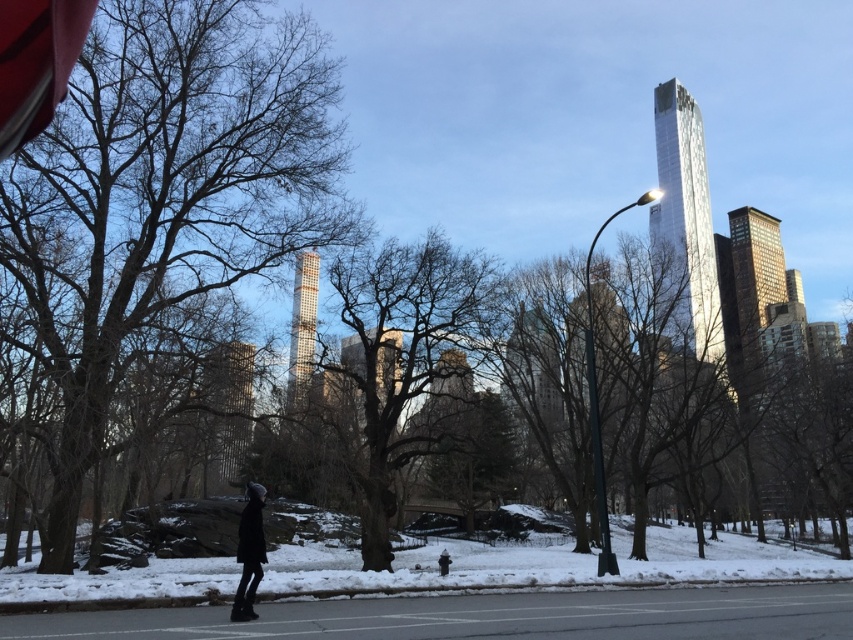
Question: Is smooth brown tree at left smaller than black matte coat at center?

Choices:
 (A) yes
 (B) no

Answer: (B)

Question: Estimate the real-world distances between objects in this image. Which object is closer to the smooth brown tree at left?

Choices:
 (A) black wool coat at lower left
 (B) black matte coat at center

Answer: (A)

Question: Does smooth brown tree at left have a lesser width compared to black wool coat at lower left?

Choices:
 (A) yes
 (B) no

Answer: (B)

Question: Which object is positioned farthest from the smooth brown tree at center?

Choices:
 (A) black matte coat at center
 (B) smooth brown tree at left
 (C) black wool coat at lower left

Answer: (C)

Question: Does smooth brown tree at center have a greater width compared to black matte coat at center?

Choices:
 (A) yes
 (B) no

Answer: (A)

Question: Which object is positioned closest to the black matte coat at center?

Choices:
 (A) black wool coat at lower left
 (B) smooth brown tree at left
 (C) smooth brown tree at center

Answer: (A)